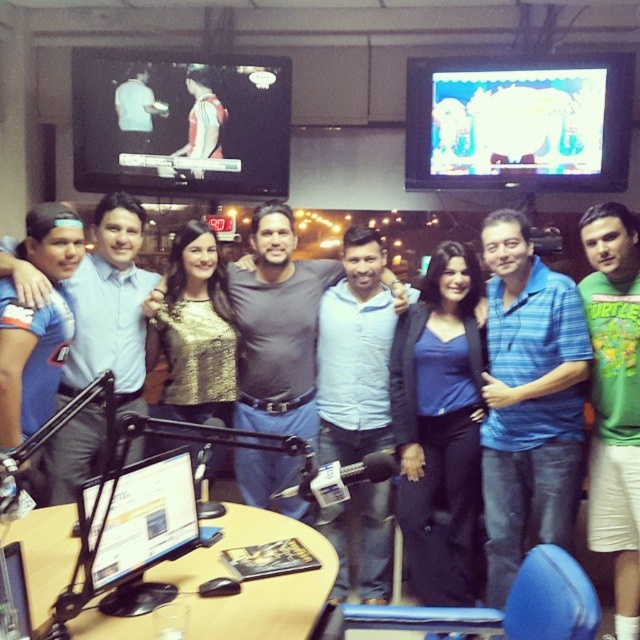
In the scene shown: You are a photographer setting up for a group photo in the studio. You need to ensure that the blue striped polo shirt at center and the blue denim jeans at center are both visible in the frame. Considering their heights, which one might require you to adjust the camera angle to capture fully?

The blue striped polo shirt at center is shorter than the blue denim jeans at center, so you might need to lower the camera angle to ensure the shorter blue striped polo shirt at center is fully visible while also capturing the taller blue denim jeans at center.

You are a photographer setting up for a group photo in the studio. You need to ensure that the blue striped polo shirt at center and the blue denim jeans at center are visible in the frame. Given that your camera has a minimum focus distance of 24 inches, will you need to adjust your position to capture both items clearly?

The distance between the blue striped polo shirt at center and the blue denim jeans at center is 22.72 inches, which is less than the camera minimum focus distance of 24 inches. Therefore, you will need to move closer to ensure both items are in focus.